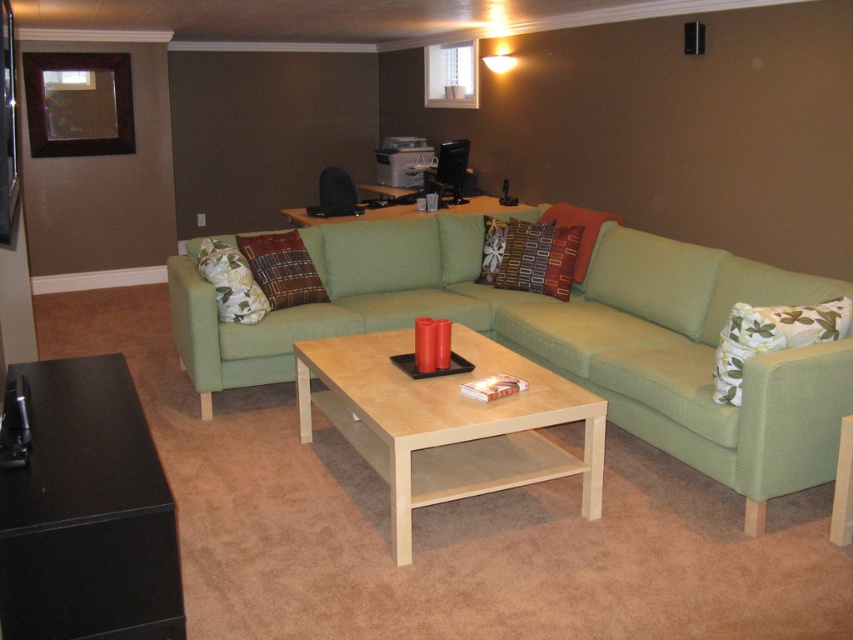
Question: Which point is closer to the camera?

Choices:
 (A) (347, 209)
 (B) (312, 296)
 (C) (445, 208)

Answer: (B)

Question: Does textured multicolored pillow at center have a lesser width compared to light wood/finished table at center?

Choices:
 (A) no
 (B) yes

Answer: (B)

Question: Is green fabric couch at center further to camera compared to floral fabric pillow at right?

Choices:
 (A) yes
 (B) no

Answer: (B)

Question: Which object appears closest to the camera in this image?

Choices:
 (A) brown woven pillow at center
 (B) light wood/veneer coffee table at center
 (C) green floral pillow at left

Answer: (B)

Question: Is brown woven pillow at center bigger than light wood/finished table at center?

Choices:
 (A) no
 (B) yes

Answer: (A)

Question: Which point is closer to the camera?

Choices:
 (A) light wood/veneer coffee table at center
 (B) light wood/finished table at center

Answer: (A)